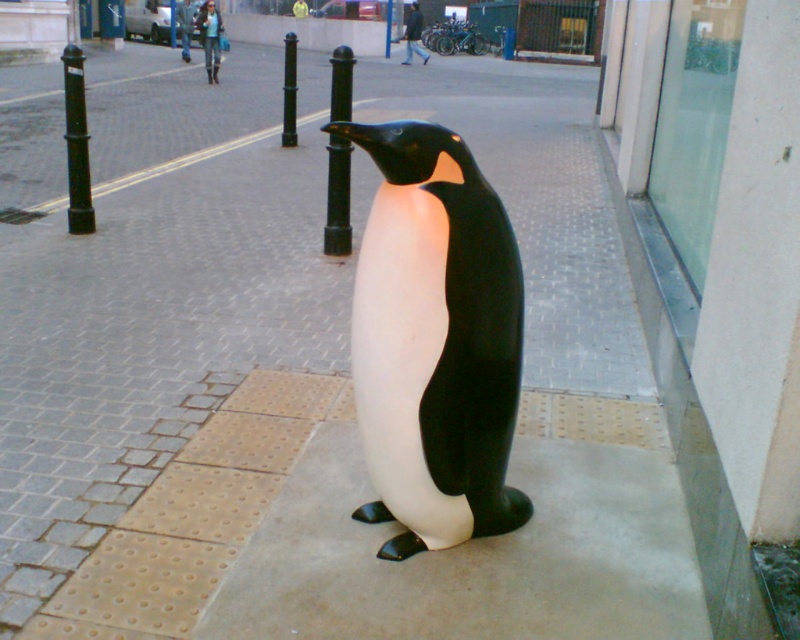
Question: Is black metal pole at center bigger than black glossy pole at center?

Choices:
 (A) no
 (B) yes

Answer: (B)

Question: Estimate the real-world distances between objects in this image. Which object is farther from the black metal pole at center?

Choices:
 (A) brushed metal pole at center
 (B) white matte penguin at center
 (C) black metal pole at left
 (D) black glossy pole at center

Answer: (B)

Question: Is the position of black metal pole at left more distant than that of black metal pole at center?

Choices:
 (A) no
 (B) yes

Answer: (A)

Question: From the image, what is the correct spatial relationship of black polished metal pole at center in relation to black metal pole at left?

Choices:
 (A) below
 (B) above

Answer: (A)

Question: Which object appears farthest from the camera in this image?

Choices:
 (A) white matte penguin at center
 (B) black metal pole at center
 (C) brushed metal pole at center
 (D) black metal pole at left

Answer: (C)

Question: Which point is farther to the camera?

Choices:
 (A) black polished metal pole at center
 (B) white matte penguin at center

Answer: (A)